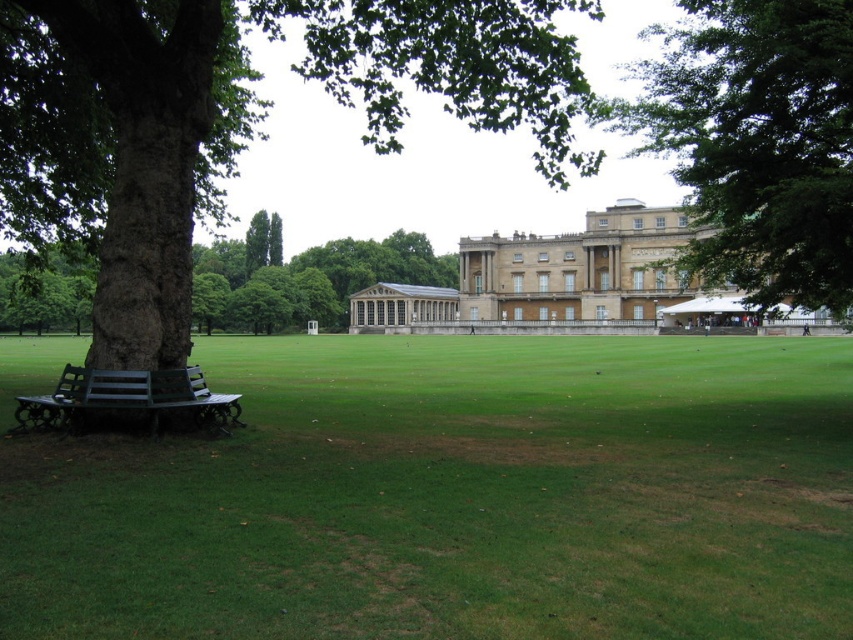
Question: Does green grass at lower center have a larger size compared to green rough bark tree at left?

Choices:
 (A) yes
 (B) no

Answer: (B)

Question: Which point is farther to the camera?

Choices:
 (A) green rough bark tree at left
 (B) beige stone palace at center
 (C) green leafy tree at upper right

Answer: (B)

Question: Which point is closer to the camera?

Choices:
 (A) green rough bark tree at left
 (B) beige stone palace at center

Answer: (A)

Question: Can you confirm if green leafy tree at upper right is smaller than beige stone palace at center?

Choices:
 (A) no
 (B) yes

Answer: (A)

Question: Which is farther from the green painted wood bench at lower left?

Choices:
 (A) brown rough bark tree at left
 (B) green rough bark tree at left

Answer: (A)

Question: Can you confirm if green grass at lower center is positioned below green rough bark tree at left?

Choices:
 (A) yes
 (B) no

Answer: (A)